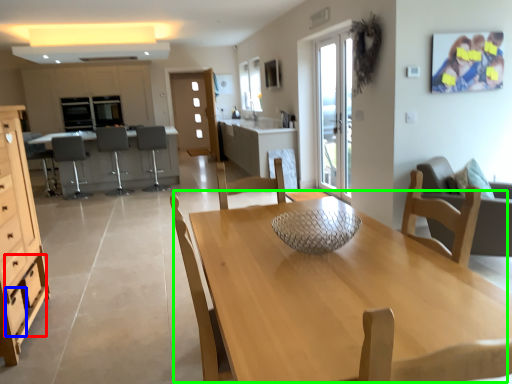
Question: Which object is the closest to the drawer (highlighted by a red box)? Choose among these: drawer (highlighted by a blue box) or kitchen & dining room table (highlighted by a green box).

Choices:
 (A) drawer
 (B) kitchen & dining room table

Answer: (A)